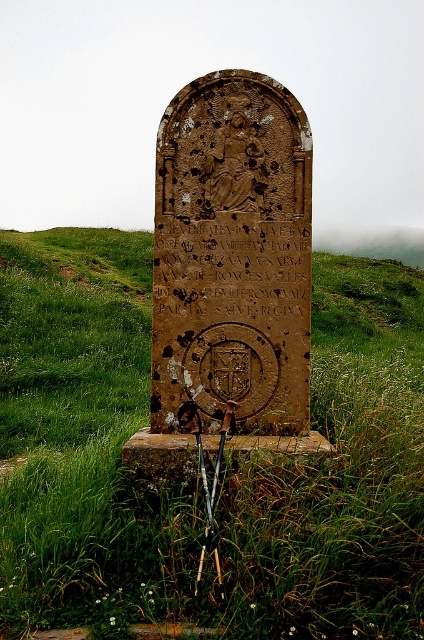
Question: Which object appears farthest from the camera in this image?

Choices:
 (A) green grassy at center
 (B) brown stone inscription at center
 (C) brown stone plaque at center

Answer: (B)

Question: Considering the relative positions of brown stone plaque at center and brown stone inscription at center in the image provided, where is brown stone plaque at center located with respect to brown stone inscription at center?

Choices:
 (A) right
 (B) left

Answer: (B)

Question: Is green grassy at center wider than brown stone plaque at center?

Choices:
 (A) yes
 (B) no

Answer: (A)

Question: Which point is closer to the camera taking this photo?

Choices:
 (A) (301, 612)
 (B) (253, 376)

Answer: (A)

Question: Estimate the real-world distances between objects in this image. Which object is farther from the brown stone plaque at center?

Choices:
 (A) green grassy at center
 (B) brown stone inscription at center

Answer: (A)

Question: Does green grassy at center have a larger size compared to brown stone plaque at center?

Choices:
 (A) no
 (B) yes

Answer: (B)